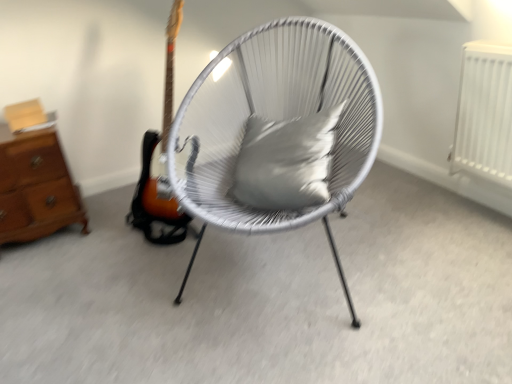
Question: Is satin gray pillow at center next to brown wooden chest of drawers at left?

Choices:
 (A) yes
 (B) no

Answer: (B)

Question: Is satin gray pillow at center turned away from brown wooden chest of drawers at left?

Choices:
 (A) yes
 (B) no

Answer: (B)

Question: Does satin gray pillow at center have a lesser height compared to brown wooden chest of drawers at left?

Choices:
 (A) yes
 (B) no

Answer: (A)

Question: Is satin gray pillow at center thinner than brown wooden chest of drawers at left?

Choices:
 (A) no
 (B) yes

Answer: (B)

Question: Does satin gray pillow at center have a greater width compared to brown wooden chest of drawers at left?

Choices:
 (A) no
 (B) yes

Answer: (A)

Question: From the image's perspective, does satin gray pillow at center appear lower than brown wooden chest of drawers at left?

Choices:
 (A) no
 (B) yes

Answer: (A)

Question: From the image's perspective, would you say brown wooden chest of drawers at left is shown under satin gray pillow at center?

Choices:
 (A) yes
 (B) no

Answer: (A)

Question: Is the depth of brown wooden chest of drawers at left less than that of satin gray pillow at center?

Choices:
 (A) yes
 (B) no

Answer: (B)

Question: Is brown wooden chest of drawers at left bigger than satin gray pillow at center?

Choices:
 (A) no
 (B) yes

Answer: (B)

Question: Is brown wooden chest of drawers at left looking in the opposite direction of satin gray pillow at center?

Choices:
 (A) yes
 (B) no

Answer: (B)

Question: Does brown wooden chest of drawers at left come behind satin gray pillow at center?

Choices:
 (A) yes
 (B) no

Answer: (A)

Question: Could you tell me if brown wooden chest of drawers at left is facing satin gray pillow at center?

Choices:
 (A) yes
 (B) no

Answer: (B)

Question: Is brown wooden chest of drawers at left far away from white woven chair at center?

Choices:
 (A) no
 (B) yes

Answer: (A)